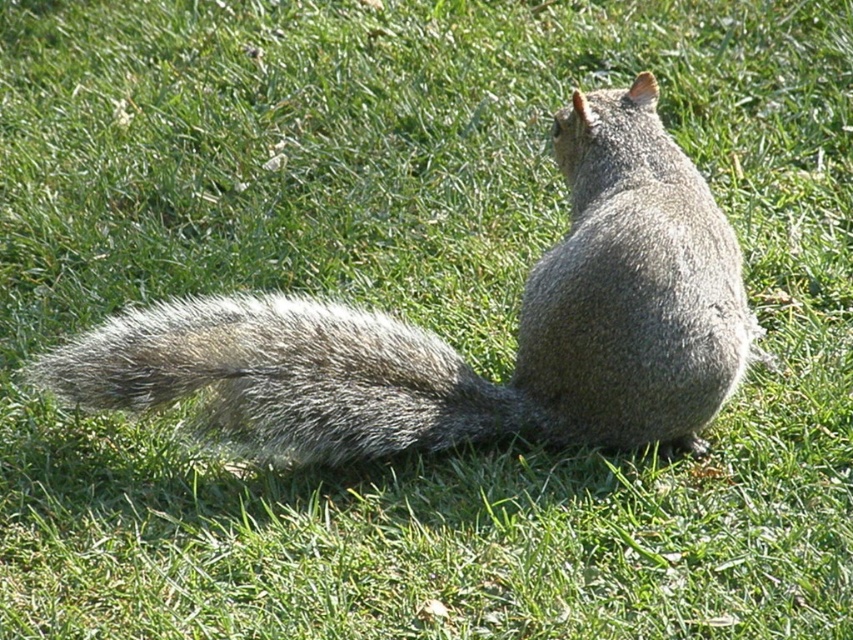
Looking at this image, you are a photographer trying to capture a closeup of the gray furry squirrel at center and the fuzzy gray tail at lower left. Since you want to focus on both, which object should you zoom in on first to ensure both are in frame?

The gray furry squirrel at center is larger than the fuzzy gray tail at lower left, so you should zoom in on the gray furry squirrel at center first to ensure both are in frame.